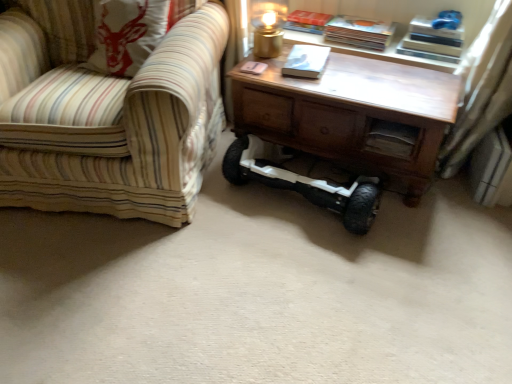
Question: Considering the relative sizes of gold metallic table lamp at upper center and wooden table at center in the image provided, is gold metallic table lamp at upper center shorter than wooden table at center?

Choices:
 (A) no
 (B) yes

Answer: (B)

Question: Is gold metallic table lamp at upper center closer to camera compared to wooden table at center?

Choices:
 (A) yes
 (B) no

Answer: (B)

Question: Considering the relative sizes of gold metallic table lamp at upper center and wooden table at center in the image provided, is gold metallic table lamp at upper center wider than wooden table at center?

Choices:
 (A) no
 (B) yes

Answer: (A)

Question: From the image's perspective, would you say gold metallic table lamp at upper center is positioned over wooden table at center?

Choices:
 (A) yes
 (B) no

Answer: (A)

Question: Is gold metallic table lamp at upper center next to wooden table at center and touching it?

Choices:
 (A) no
 (B) yes

Answer: (A)

Question: From the image's perspective, is striped fabric chair at left above or below white matte hoverboard at center?

Choices:
 (A) above
 (B) below

Answer: (A)

Question: Considering the positions of striped fabric chair at left and white matte hoverboard at center in the image, is striped fabric chair at left taller or shorter than white matte hoverboard at center?

Choices:
 (A) short
 (B) tall

Answer: (B)

Question: Does point (62, 29) appear closer or farther from the camera than point (367, 182)?

Choices:
 (A) farther
 (B) closer

Answer: (A)

Question: Is striped fabric chair at left wider or thinner than white matte hoverboard at center?

Choices:
 (A) wide
 (B) thin

Answer: (A)

Question: In the image, is gold metallic table lamp at upper center on the left side or the right side of white matte book at center, marked as the first book in a front-to-back arrangement?

Choices:
 (A) right
 (B) left

Answer: (B)

Question: Looking at the image, does gold metallic table lamp at upper center seem bigger or smaller compared to white matte book at center, positioned as the 3th book in back-to-front order?

Choices:
 (A) big
 (B) small

Answer: (A)

Question: Is gold metallic table lamp at upper center spatially inside white matte book at center, marked as the first book in a front-to-back arrangement, or outside of it?

Choices:
 (A) outside
 (B) inside

Answer: (A)

Question: From the image's perspective, is gold metallic table lamp at upper center located above or below white matte book at center, marked as the first book in a front-to-back arrangement?

Choices:
 (A) above
 (B) below

Answer: (A)

Question: Would you say hardcover book at upper center, the third book viewed from the front, is to the left or to the right of gold metallic table lamp at upper center in the picture?

Choices:
 (A) left
 (B) right

Answer: (B)

Question: Is hardcover book at upper center, the third book viewed from the front, bigger or smaller than gold metallic table lamp at upper center?

Choices:
 (A) big
 (B) small

Answer: (B)